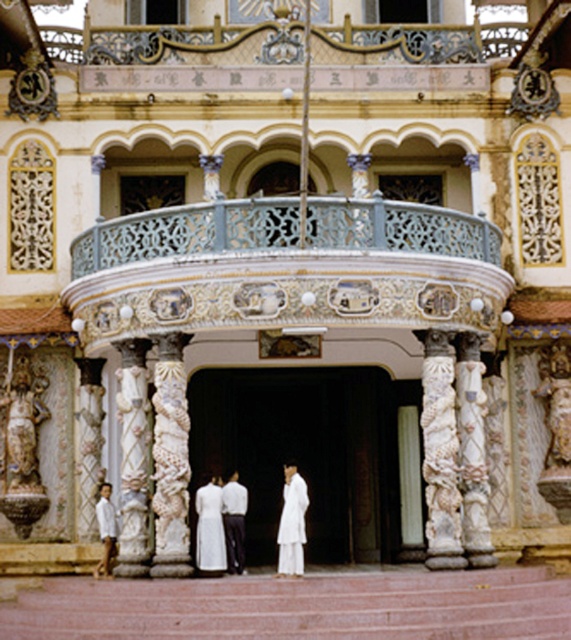
You are a visitor standing at the entrance of the grand building. You notice the white ornate balcony at upper center and the white cotton shirt at lower left. Which object is positioned higher in the scene?

The white ornate balcony at upper center is positioned higher than the white cotton shirt at lower left.